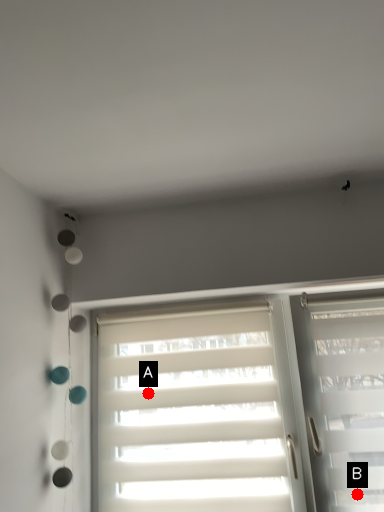
Question: Two points are circled on the image, labeled by A and B beside each circle. Which point is farther from the camera taking this photo?

Choices:
 (A) A is further
 (B) B is further

Answer: (A)